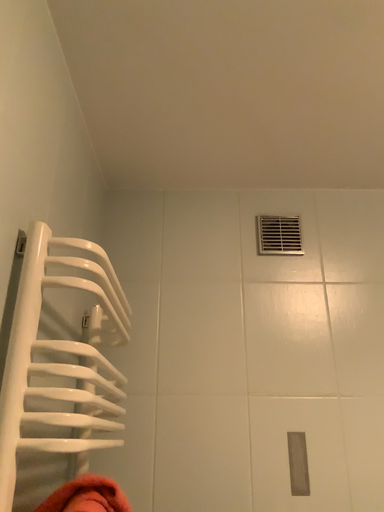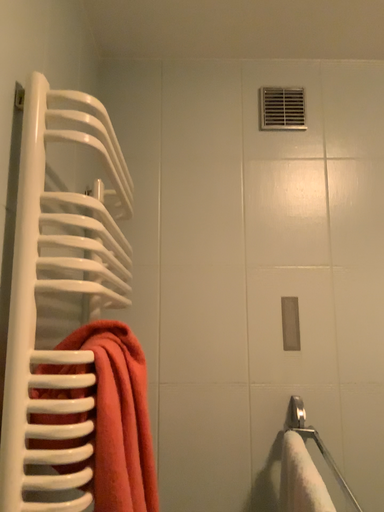
Question: Which way did the camera rotate in the video?

Choices:
 (A) rotated upward
 (B) rotated downward

Answer: (B)